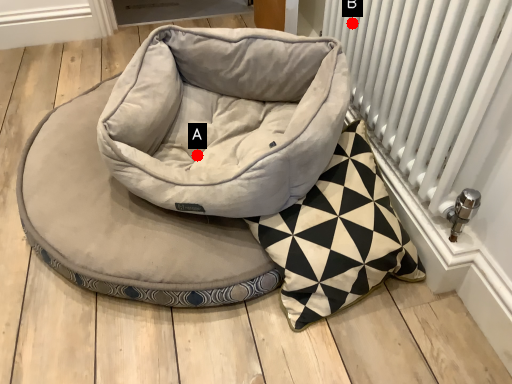
Question: Two points are circled on the image, labeled by A and B beside each circle. Which point is farther to the camera?

Choices:
 (A) A is further
 (B) B is further

Answer: (B)